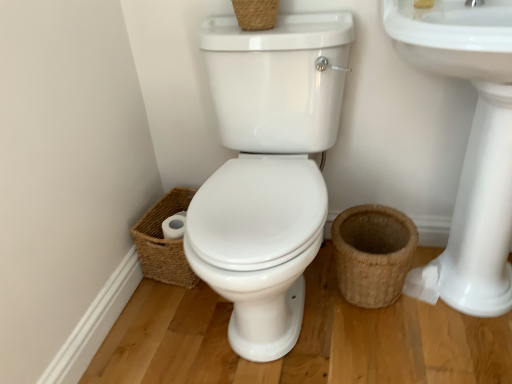
I want to click on woven brown basket at lower left, the 3th basket positioned from the right, so click(x=164, y=242).

What is the approximate width of white glossy sink at upper right, which appears as the second sink when viewed from the right?

The width of white glossy sink at upper right, which appears as the second sink when viewed from the right, is 27.77 inches.

Describe the element at coordinates (268, 170) in the screenshot. This screenshot has height=384, width=512. I see `white glossy sink at upper right, which appears as the second sink when viewed from the right` at that location.

Find the location of a particular element. The height and width of the screenshot is (384, 512). brown woven basket at lower right, the first basket from the right is located at coordinates (372, 253).

From the image's perspective, is woven brown basket at lower left, the 3th basket positioned from the right, above woven brown basket at upper center, arranged as the 2th basket when viewed from the left?

No.

Who is smaller, woven brown basket at lower left, the 3th basket positioned from the right, or woven brown basket at upper center, which is the 2th basket in right-to-left order?

Smaller between the two is woven brown basket at upper center, which is the 2th basket in right-to-left order.

Is there a large distance between woven brown basket at lower left, acting as the first basket starting from the left, and woven brown basket at upper center, the 1th basket in the top-to-bottom sequence?

They are positioned close to each other.

Can we say woven brown basket at lower left, acting as the second basket starting from the top, lies outside woven brown basket at upper center, the 1th basket in the top-to-bottom sequence?

Yes, woven brown basket at lower left, acting as the second basket starting from the top, is located beyond the bounds of woven brown basket at upper center, the 1th basket in the top-to-bottom sequence.

Considering the positions of objects woven brown basket at upper center, acting as the third basket starting from the bottom, and brown woven basket at lower right, placed as the 1th basket when sorted from bottom to top, in the image provided, who is in front, woven brown basket at upper center, acting as the third basket starting from the bottom, or brown woven basket at lower right, placed as the 1th basket when sorted from bottom to top,?

woven brown basket at upper center, acting as the third basket starting from the bottom, is more forward.

Is woven brown basket at upper center, arranged as the 2th basket when viewed from the left, with brown woven basket at lower right, the first basket from the right?

No, woven brown basket at upper center, arranged as the 2th basket when viewed from the left, is not next to brown woven basket at lower right, the first basket from the right.

Which is more distant, (x=260, y=10) or (x=394, y=209)?

The point (x=394, y=209) is behind.

Is woven brown basket at lower left, acting as the first basket starting from the left, inside the boundaries of white ceramic sink at right, arranged as the 2th sink when viewed from the left, or outside?

woven brown basket at lower left, acting as the first basket starting from the left, is outside white ceramic sink at right, arranged as the 2th sink when viewed from the left.

Which is further, (164, 274) or (508, 279)?

The point (164, 274) is behind.

Is woven brown basket at lower left, the 3th basket positioned from the right, positioned far away from white ceramic sink at right, positioned as the first sink in right-to-left order?

No, woven brown basket at lower left, the 3th basket positioned from the right, is in close proximity to white ceramic sink at right, positioned as the first sink in right-to-left order.

Between woven brown basket at lower left, acting as the first basket starting from the left, and white ceramic sink at right, positioned as the first sink in right-to-left order, which one appears on the left side from the viewer's perspective?

Positioned to the left is woven brown basket at lower left, acting as the first basket starting from the left.

Who is shorter, brown woven basket at lower right, the first basket from the right, or woven brown basket at lower left, the 3th basket positioned from the right?

woven brown basket at lower left, the 3th basket positioned from the right, is shorter.

Looking at their sizes, would you say brown woven basket at lower right, which appears as the 3th basket when viewed from the left, is wider or thinner than woven brown basket at lower left, the 3th basket positioned from the right?

Clearly, brown woven basket at lower right, which appears as the 3th basket when viewed from the left, has less width compared to woven brown basket at lower left, the 3th basket positioned from the right.

Would you say woven brown basket at lower left, acting as the second basket starting from the top, is part of brown woven basket at lower right, placed as the 1th basket when sorted from bottom to top,'s contents?

Actually, woven brown basket at lower left, acting as the second basket starting from the top, is outside brown woven basket at lower right, placed as the 1th basket when sorted from bottom to top.

Which is more to the right, brown woven basket at lower right, placed as the 1th basket when sorted from bottom to top, or woven brown basket at lower left, acting as the first basket starting from the left?

brown woven basket at lower right, placed as the 1th basket when sorted from bottom to top.

Is white ceramic sink at right, positioned as the first sink in right-to-left order, thinner than brown woven basket at lower right, which appears as the 3th basket when viewed from the left?

No, white ceramic sink at right, positioned as the first sink in right-to-left order, is not thinner than brown woven basket at lower right, which appears as the 3th basket when viewed from the left.

What's the angular difference between white ceramic sink at right, arranged as the 2th sink when viewed from the left, and brown woven basket at lower right, placed as the 1th basket when sorted from bottom to top,'s facing directions?

3.57 degrees.

Is white ceramic sink at right, positioned as the first sink in right-to-left order, aimed at brown woven basket at lower right, placed as the 1th basket when sorted from bottom to top?

No, white ceramic sink at right, positioned as the first sink in right-to-left order, is not turned towards brown woven basket at lower right, placed as the 1th basket when sorted from bottom to top.

Considering the positions of objects woven brown basket at upper center, acting as the third basket starting from the bottom, and white glossy sink at upper right, the first sink in the left-to-right sequence, in the image provided, who is behind, woven brown basket at upper center, acting as the third basket starting from the bottom, or white glossy sink at upper right, the first sink in the left-to-right sequence,?

woven brown basket at upper center, acting as the third basket starting from the bottom.

From the image's perspective, does woven brown basket at upper center, acting as the third basket starting from the bottom, appear lower than white glossy sink at upper right, which appears as the second sink when viewed from the right?

No.

Based on the photo, is woven brown basket at upper center, acting as the third basket starting from the bottom, positioned far away from white glossy sink at upper right, the first sink in the left-to-right sequence?

No.

Is woven brown basket at upper center, which is the 2th basket in right-to-left order, shorter than white glossy sink at upper right, the first sink in the left-to-right sequence?

Correct, woven brown basket at upper center, which is the 2th basket in right-to-left order, is not as tall as white glossy sink at upper right, the first sink in the left-to-right sequence.

Which is closer, (308, 175) or (258, 28)?

Point (308, 175) is positioned farther from the camera compared to point (258, 28).

Is white glossy sink at upper right, which appears as the second sink when viewed from the right, wider or thinner than woven brown basket at upper center, acting as the third basket starting from the bottom?

Clearly, white glossy sink at upper right, which appears as the second sink when viewed from the right, has more width compared to woven brown basket at upper center, acting as the third basket starting from the bottom.

Could you tell me if white glossy sink at upper right, the first sink in the left-to-right sequence, is turned towards woven brown basket at upper center, arranged as the 2th basket when viewed from the left?

No.

I want to click on the 2nd basket in front of the woven brown basket at lower left, acting as the first basket starting from the left, so click(256, 14).

Find the location of `the 1st basket directly beneath the woven brown basket at upper center, the 1th basket in the top-to-bottom sequence (from a real-world perspective)`. the 1st basket directly beneath the woven brown basket at upper center, the 1th basket in the top-to-bottom sequence (from a real-world perspective) is located at coordinates (372, 253).

Which object lies nearer to the anchor point brown woven basket at lower right, the first basket from the right, woven brown basket at upper center, the 1th basket in the top-to-bottom sequence, or white glossy sink at upper right, which appears as the second sink when viewed from the right?

Answer: The object closer to brown woven basket at lower right, the first basket from the right, is white glossy sink at upper right, which appears as the second sink when viewed from the right.

Which object lies nearer to the anchor point white glossy sink at upper right, the first sink in the left-to-right sequence, woven brown basket at upper center, which is the 2th basket in right-to-left order, or woven brown basket at lower left, the second basket when ordered from bottom to top?

woven brown basket at upper center, which is the 2th basket in right-to-left order, is closer to white glossy sink at upper right, the first sink in the left-to-right sequence.

Which object lies further to the anchor point white glossy sink at upper right, which appears as the second sink when viewed from the right, white ceramic sink at right, arranged as the 2th sink when viewed from the left, or woven brown basket at upper center, which is the 2th basket in right-to-left order?

The object further to white glossy sink at upper right, which appears as the second sink when viewed from the right, is white ceramic sink at right, arranged as the 2th sink when viewed from the left.

From the image, which object appears to be farther from white glossy sink at upper right, which appears as the second sink when viewed from the right, woven brown basket at lower left, acting as the second basket starting from the top, or brown woven basket at lower right, placed as the 1th basket when sorted from bottom to top?

woven brown basket at lower left, acting as the second basket starting from the top, is further to white glossy sink at upper right, which appears as the second sink when viewed from the right.

When comparing their distances from woven brown basket at lower left, the 3th basket positioned from the right, does brown woven basket at lower right, the first basket from the right, or woven brown basket at upper center, acting as the third basket starting from the bottom, seem closer?

brown woven basket at lower right, the first basket from the right, is closer to woven brown basket at lower left, the 3th basket positioned from the right.

Looking at the image, which one is located further to white ceramic sink at right, arranged as the 2th sink when viewed from the left, woven brown basket at upper center, the 1th basket in the top-to-bottom sequence, or brown woven basket at lower right, the first basket from the right?

woven brown basket at upper center, the 1th basket in the top-to-bottom sequence, is positioned further to the anchor white ceramic sink at right, arranged as the 2th sink when viewed from the left.

Based on their spatial positions, is white ceramic sink at right, arranged as the 2th sink when viewed from the left, or woven brown basket at upper center, acting as the third basket starting from the bottom, closer to woven brown basket at lower left, acting as the second basket starting from the top?

Based on the image, woven brown basket at upper center, acting as the third basket starting from the bottom, appears to be nearer to woven brown basket at lower left, acting as the second basket starting from the top.

Looking at the image, which one is located further to white ceramic sink at right, arranged as the 2th sink when viewed from the left, white glossy sink at upper right, the first sink in the left-to-right sequence, or woven brown basket at upper center, the 1th basket in the top-to-bottom sequence?

woven brown basket at upper center, the 1th basket in the top-to-bottom sequence, lies further to white ceramic sink at right, arranged as the 2th sink when viewed from the left, than the other object.

Locate an element on the screen. Image resolution: width=512 pixels, height=384 pixels. basket that lies between woven brown basket at upper center, arranged as the 2th basket when viewed from the left, and brown woven basket at lower right, the first basket from the right, from top to bottom is located at coordinates pyautogui.click(x=164, y=242).

Identify the location of sink between woven brown basket at lower left, acting as the first basket starting from the left, and white ceramic sink at right, positioned as the first sink in right-to-left order, in the horizontal direction. This screenshot has height=384, width=512. (268, 170).

The image size is (512, 384). What are the coordinates of `basket between white glossy sink at upper right, which appears as the second sink when viewed from the right, and white ceramic sink at right, arranged as the 2th sink when viewed from the left` in the screenshot? It's located at pos(372,253).

Where is `sink between woven brown basket at upper center, acting as the third basket starting from the bottom, and white ceramic sink at right, positioned as the first sink in right-to-left order, from left to right`? The image size is (512, 384). sink between woven brown basket at upper center, acting as the third basket starting from the bottom, and white ceramic sink at right, positioned as the first sink in right-to-left order, from left to right is located at coordinates (268, 170).